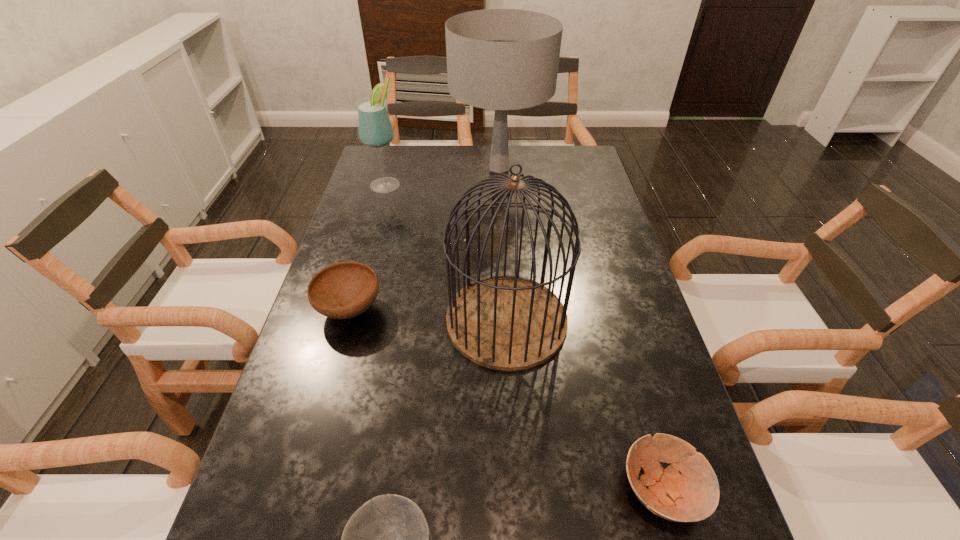
In the image, there is a desktop. Where is `vacant space at the left edge`? Image resolution: width=960 pixels, height=540 pixels. vacant space at the left edge is located at coordinates (x=363, y=238).

The height and width of the screenshot is (540, 960). What are the coordinates of `free space at the right edge` in the screenshot? It's located at (609, 402).

You are a GUI agent. You are given a task and a screenshot of the screen. Output one action in this format:
    pyautogui.click(x=<x>, y=<y>)
    Task: Click on the blank space at the far left corner of the desktop
    The width and height of the screenshot is (960, 540).
    Given the screenshot: What is the action you would take?
    pyautogui.click(x=372, y=151)

The height and width of the screenshot is (540, 960). In order to click on vacant region between the rightmost bowl and the birdcage in this screenshot , I will do `click(585, 405)`.

You are a GUI agent. You are given a task and a screenshot of the screen. Output one action in this format:
    pyautogui.click(x=<x>, y=<y>)
    Task: Click on the vacant space in between the lampshade and the alcohol
    The width and height of the screenshot is (960, 540).
    Given the screenshot: What is the action you would take?
    pyautogui.click(x=443, y=176)

Where is `unoccupied position between the alcohol and the lampshade`? Image resolution: width=960 pixels, height=540 pixels. unoccupied position between the alcohol and the lampshade is located at coordinates click(x=443, y=176).

Find the location of a particular element. Image resolution: width=960 pixels, height=540 pixels. free spot between the farthest bowl and the alcohol is located at coordinates (368, 247).

You are a GUI agent. You are given a task and a screenshot of the screen. Output one action in this format:
    pyautogui.click(x=<x>, y=<y>)
    Task: Click on the free spot between the birdcage and the tallest bowl
    The height and width of the screenshot is (540, 960).
    Given the screenshot: What is the action you would take?
    pyautogui.click(x=428, y=315)

At what (x,y) coordinates should I click in order to perform the action: click on the closest object relative to the rightmost object. Please return your answer as a coordinate pair (x, y). The image size is (960, 540). Looking at the image, I should click on (503, 322).

I want to click on object that can be found as the third closest to the birdcage, so click(387, 539).